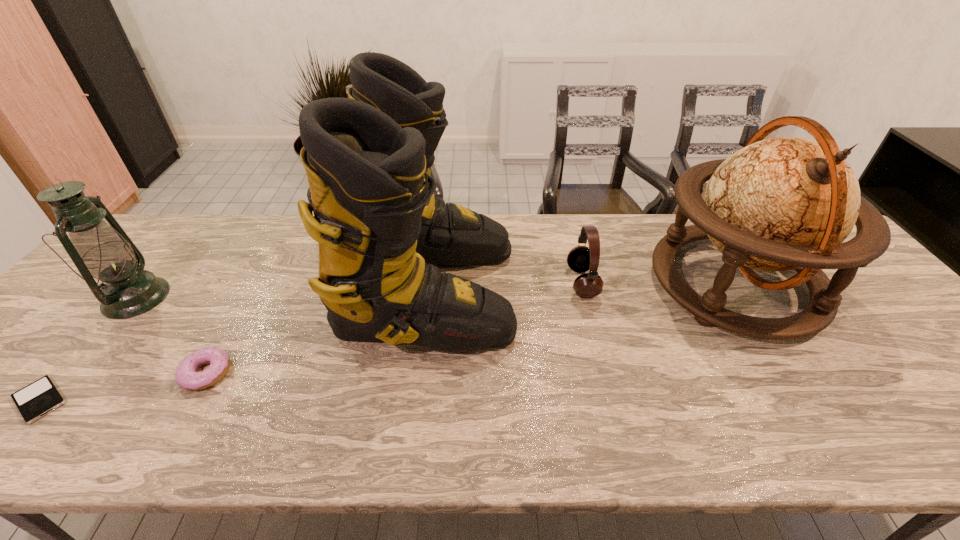
Select which object appears as the second closest to the headset. Please provide its 2D coordinates. Your answer should be formatted as a tuple, i.e. [(x, y)], where the tuple contains the x and y coordinates of a point satisfying the conditions above.

[(786, 203)]

Image resolution: width=960 pixels, height=540 pixels. In order to click on vacant space that satisfies the following two spatial constraints: 1. on the ear pads of the fourth tallest object; 2. on the front side of the third object from right to left in this screenshot , I will do `click(585, 291)`.